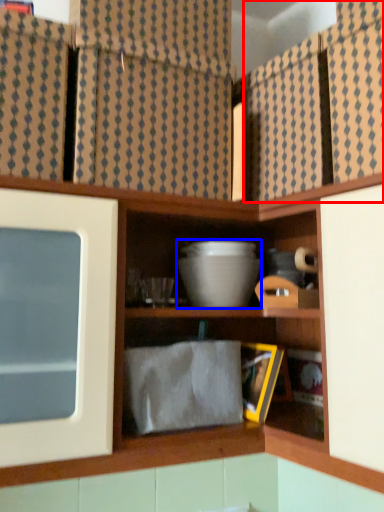
Question: Which of the following is the farthest to the observer, cabinet (highlighted by a red box) or mixing bowl (highlighted by a blue box)?

Choices:
 (A) cabinet
 (B) mixing bowl

Answer: (B)